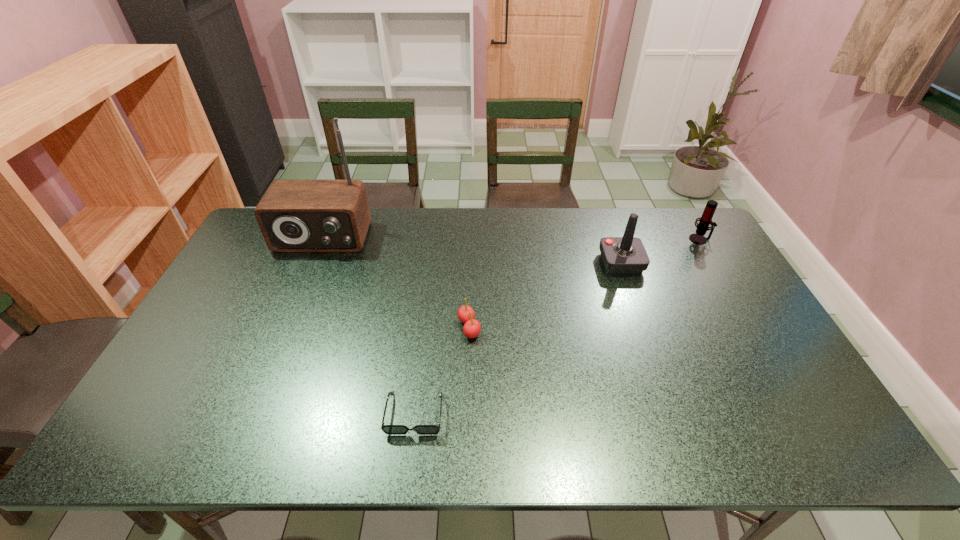
Where is `vacant space that's between the sunglasses and the leftmost object`? vacant space that's between the sunglasses and the leftmost object is located at coordinates (369, 326).

At what (x,y) coordinates should I click in order to perform the action: click on free space between the fourth object from left to right and the second nearest object. Please return your answer as a coordinate pair (x, y). Looking at the image, I should click on (545, 295).

This screenshot has height=540, width=960. In order to click on empty space that is in between the second nearest object and the joystick in this screenshot , I will do `click(545, 295)`.

Where is `empty location between the tallest object and the fourth farthest object`? The image size is (960, 540). empty location between the tallest object and the fourth farthest object is located at coordinates (396, 283).

You are a GUI agent. You are given a task and a screenshot of the screen. Output one action in this format:
    pyautogui.click(x=<x>, y=<y>)
    Task: Click on the vacant point located between the fourth object from left to right and the radio receiver
    
    Given the screenshot: What is the action you would take?
    (471, 251)

The image size is (960, 540). I want to click on free space between the rightmost object and the shortest object, so tap(557, 326).

Find the location of a particular element. The height and width of the screenshot is (540, 960). empty space that is in between the second shortest object and the nearest object is located at coordinates (442, 370).

Locate an element on the screen. The width and height of the screenshot is (960, 540). the fourth closest object relative to the fourth shortest object is located at coordinates (294, 215).

Locate which object ranks fourth in proximity to the fourth farthest object. Please provide its 2D coordinates. Your answer should be formatted as a tuple, i.e. [(x, y)], where the tuple contains the x and y coordinates of a point satisfying the conditions above.

[(705, 220)]

In order to click on vacant point that satisfies the following two spatial constraints: 1. on the front-facing side of the radio receiver; 2. on the left side of the microphone in this screenshot , I will do (x=322, y=239).